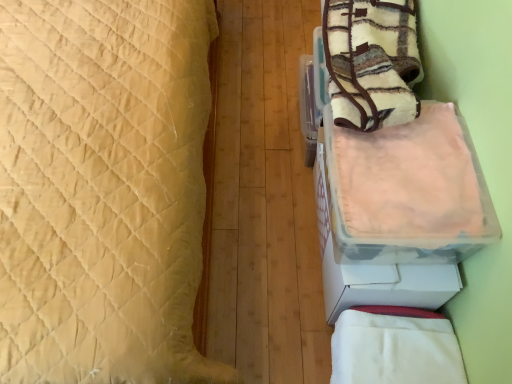
You are a GUI agent. You are given a task and a screenshot of the screen. Output one action in this format:
    pyautogui.click(x=<x>, y=<y>)
    Task: Click on the vacant region above white soft blanket at lower right, acting as the 1th blanket starting from the bottom (from a real-world perspective)
    
    Given the screenshot: What is the action you would take?
    pyautogui.click(x=396, y=344)